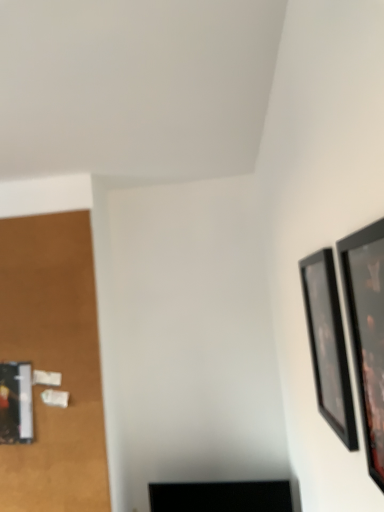
Question: Is black glossy picture frame at upper right, which ranks as the first picture frame in front-to-back order, located within black glossy picture frame at right, which is the first picture frame from back to front?

Choices:
 (A) no
 (B) yes

Answer: (A)

Question: Would you consider black glossy picture frame at right, the second picture frame positioned from the front, to be distant from black glossy picture frame at upper right, arranged as the 2th picture frame when viewed from the back?

Choices:
 (A) no
 (B) yes

Answer: (A)

Question: Considering the relative sizes of black glossy picture frame at right, which is the first picture frame from back to front, and black glossy picture frame at upper right, which ranks as the first picture frame in front-to-back order, in the image provided, is black glossy picture frame at right, which is the first picture frame from back to front, thinner than black glossy picture frame at upper right, which ranks as the first picture frame in front-to-back order,?

Choices:
 (A) no
 (B) yes

Answer: (B)

Question: Is black glossy picture frame at right, the second picture frame positioned from the front, bigger than black glossy picture frame at upper right, which ranks as the first picture frame in front-to-back order?

Choices:
 (A) no
 (B) yes

Answer: (A)

Question: Can we say black glossy picture frame at right, which is the first picture frame from back to front, lies outside black glossy picture frame at upper right, arranged as the 2th picture frame when viewed from the back?

Choices:
 (A) no
 (B) yes

Answer: (B)

Question: From the image's perspective, is black glossy picture frame at right, which is the first picture frame from back to front, under black glossy picture frame at upper right, which ranks as the first picture frame in front-to-back order?

Choices:
 (A) no
 (B) yes

Answer: (B)

Question: From a real-world perspective, is black glossy picture frame at upper right, arranged as the 2th picture frame when viewed from the back, located higher than black glossy picture frame at right, the second picture frame positioned from the front?

Choices:
 (A) no
 (B) yes

Answer: (B)

Question: Does black glossy picture frame at upper right, which ranks as the first picture frame in front-to-back order, turn towards black glossy picture frame at right, which is the first picture frame from back to front?

Choices:
 (A) no
 (B) yes

Answer: (A)

Question: Is black glossy picture frame at upper right, arranged as the 2th picture frame when viewed from the back, positioned in front of black glossy picture frame at right, which is the first picture frame from back to front?

Choices:
 (A) no
 (B) yes

Answer: (B)

Question: Would you consider black glossy picture frame at upper right, arranged as the 2th picture frame when viewed from the back, to be distant from black glossy picture frame at right, the second picture frame positioned from the front?

Choices:
 (A) yes
 (B) no

Answer: (B)

Question: From the image's perspective, is black glossy picture frame at upper right, arranged as the 2th picture frame when viewed from the back, over black glossy picture frame at right, which is the first picture frame from back to front?

Choices:
 (A) yes
 (B) no

Answer: (A)

Question: Is black glossy picture frame at upper right, arranged as the 2th picture frame when viewed from the back, to the left of black glossy picture frame at right, which is the first picture frame from back to front, from the viewer's perspective?

Choices:
 (A) yes
 (B) no

Answer: (A)

Question: From a real-world perspective, does black glossy picture frame at upper right, which ranks as the first picture frame in front-to-back order, sit lower than black glossy tv at lower center?

Choices:
 (A) yes
 (B) no

Answer: (B)